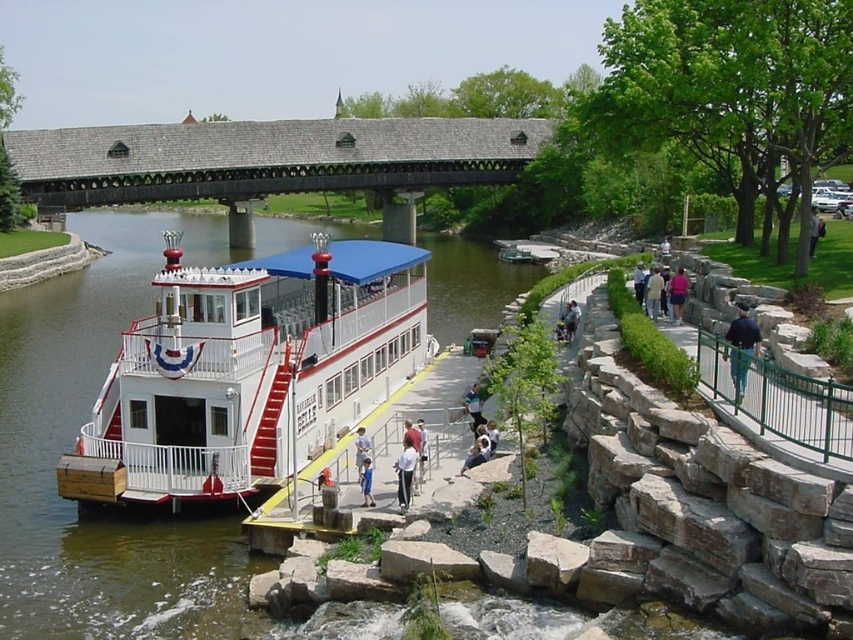
What do you see at coordinates (70, 442) in the screenshot? The width and height of the screenshot is (853, 640). I see `greenish-brown water at lower left` at bounding box center [70, 442].

Does greenish-brown water at lower left come behind wooden shingles bridge at upper center?

No, greenish-brown water at lower left is closer to the viewer.

Which is behind, point (102, 326) or point (299, 131)?

Positioned behind is point (299, 131).

Locate an element on the screen. The height and width of the screenshot is (640, 853). greenish-brown water at lower left is located at coordinates (70, 442).

Is white matte boat at center positioned behind wooden shingles bridge at upper center?

That is False.

Measure the distance between white matte boat at center and camera.

white matte boat at center is 42.09 meters away from camera.

Which is in front, point (376, 358) or point (143, 193)?

Point (376, 358) is more forward.

This screenshot has height=640, width=853. What are the coordinates of `white matte boat at center` in the screenshot? It's located at (248, 371).

Between wooden shingles bridge at upper center and dark blue fabric jacket at right, which one is positioned higher?

wooden shingles bridge at upper center

Can you confirm if wooden shingles bridge at upper center is wider than dark blue fabric jacket at right?

Indeed, wooden shingles bridge at upper center has a greater width compared to dark blue fabric jacket at right.

Is point (274, 193) farther from camera compared to point (759, 339)?

Yes, it is behind point (759, 339).

The width and height of the screenshot is (853, 640). Find the location of `wooden shingles bridge at upper center`. wooden shingles bridge at upper center is located at coordinates (271, 161).